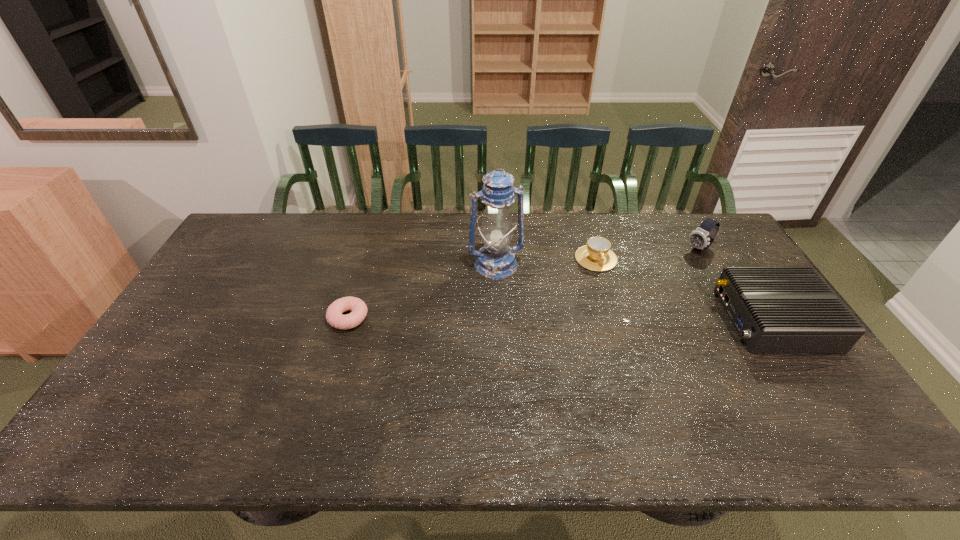
Where is `vacant space on the desktop that is between the shortest object and the third tallest object and is positioned on the front-facing side of the tallest object`? This screenshot has width=960, height=540. vacant space on the desktop that is between the shortest object and the third tallest object and is positioned on the front-facing side of the tallest object is located at coordinates (514, 319).

The width and height of the screenshot is (960, 540). I want to click on vacant spot on the desktop that is between the leftmost object and the third shortest object and is positioned with the handle on the side of the second shortest object, so click(x=621, y=319).

Image resolution: width=960 pixels, height=540 pixels. What are the coordinates of `free space on the desktop that is between the doughnut and the third tallest object and is positioned on the face of the second tallest object` in the screenshot? It's located at (595, 319).